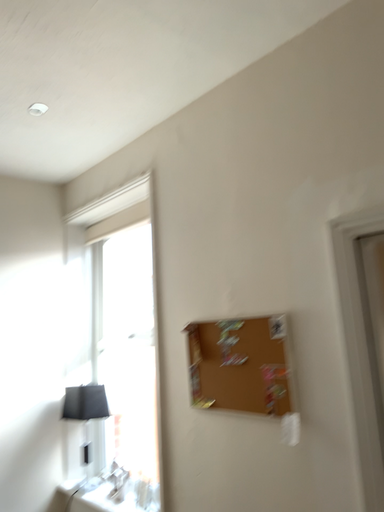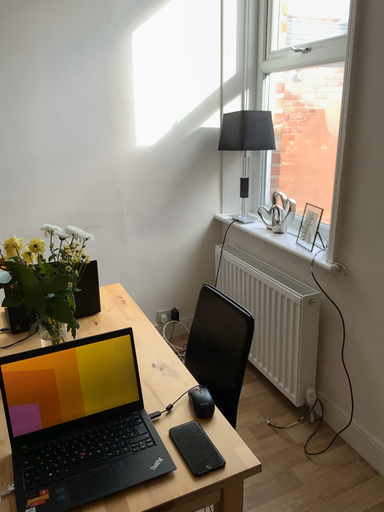
Question: Which way did the camera rotate in the video?

Choices:
 (A) rotated upward
 (B) rotated downward

Answer: (B)